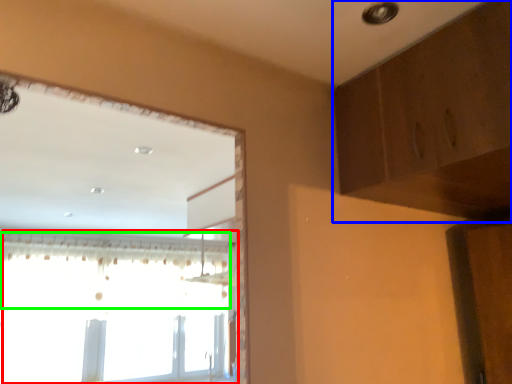
Question: Based on their relative distances, which object is nearer to window (highlighted by a red box)? Choose from dresser (highlighted by a blue box) and curtain (highlighted by a green box).

Choices:
 (A) dresser
 (B) curtain

Answer: (B)